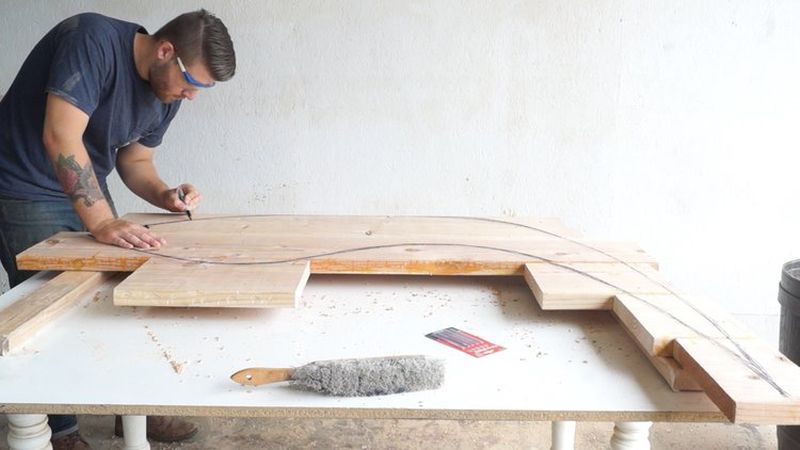
Identify the location of trash can. (790, 315).